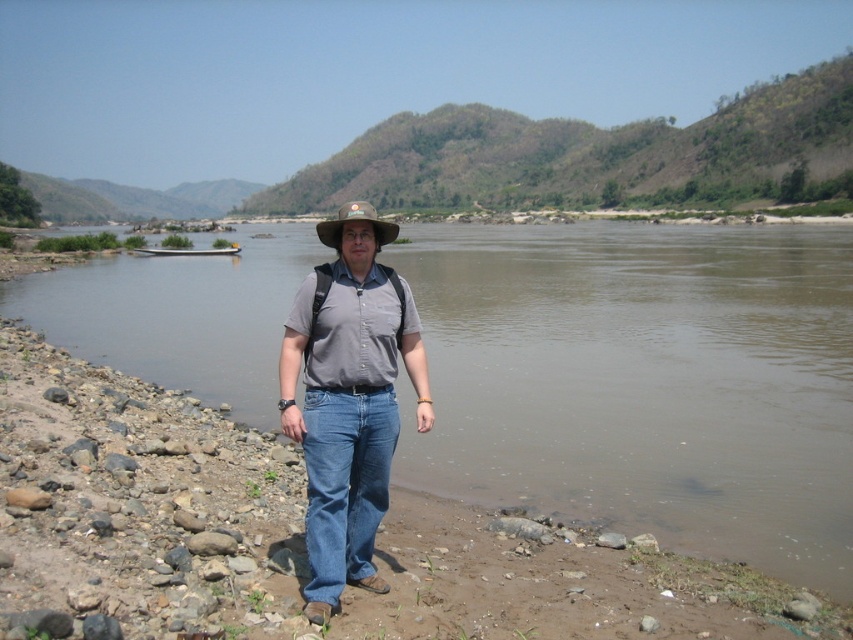
You are a hiker who wants to cross the river shown in the image. You see the brown muddy water at center and the gray matte shirt at center. Which object is higher in elevation?

The brown muddy water at center is much taller as gray matte shirt at center, meaning the water is higher in elevation than the shirt.

You are standing on the rocky riverbank and want to cross the river to the other side. There is a point marked at coordinates (x=643, y=381). What is located at this point?

The point at coordinates (x=643, y=381) corresponds to brown muddy water at center, so you would be stepping into the river at this location.

You are a hiker trying to cross the river and need to place a marker at the point that is closer to the camera. Which point should you choose between point (x=735, y=362) and point (x=352, y=220)?

Point (x=352, y=220) should be chosen because it is closer to the camera than point (x=735, y=362), which is behind it.